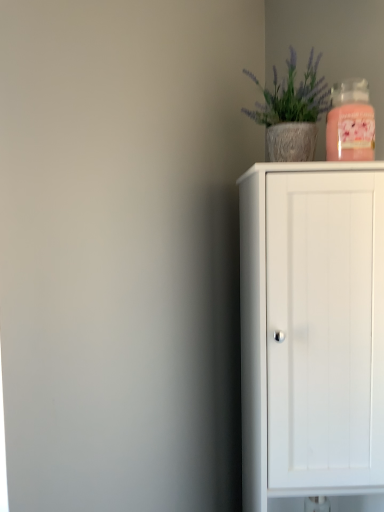
Question: Is textured concrete pot at upper right bigger than pink glass candle at upper right?

Choices:
 (A) no
 (B) yes

Answer: (B)

Question: Is pink glass candle at upper right completely or partially inside textured concrete pot at upper right?

Choices:
 (A) no
 (B) yes

Answer: (A)

Question: Is textured concrete pot at upper right shorter than pink glass candle at upper right?

Choices:
 (A) yes
 (B) no

Answer: (B)

Question: Is there a large distance between textured concrete pot at upper right and pink glass candle at upper right?

Choices:
 (A) yes
 (B) no

Answer: (B)

Question: Is textured concrete pot at upper right turned away from pink glass candle at upper right?

Choices:
 (A) no
 (B) yes

Answer: (A)

Question: Looking at their shapes, would you say pink glass candle at upper right is wider or thinner than textured concrete pot at upper right?

Choices:
 (A) thin
 (B) wide

Answer: (A)

Question: Would you say pink glass candle at upper right is inside or outside textured concrete pot at upper right?

Choices:
 (A) inside
 (B) outside

Answer: (B)

Question: From a real-world perspective, is pink glass candle at upper right physically located above or below textured concrete pot at upper right?

Choices:
 (A) below
 (B) above

Answer: (A)

Question: Based on their sizes in the image, would you say pink glass candle at upper right is bigger or smaller than textured concrete pot at upper right?

Choices:
 (A) big
 (B) small

Answer: (B)

Question: Is point (337, 159) positioned closer to the camera than point (299, 425)?

Choices:
 (A) farther
 (B) closer

Answer: (B)

Question: Is pink glass candle at upper right situated inside white matte cabinet at right or outside?

Choices:
 (A) inside
 (B) outside

Answer: (B)

Question: Looking at the image, does pink glass candle at upper right seem bigger or smaller compared to white matte cabinet at right?

Choices:
 (A) big
 (B) small

Answer: (B)

Question: From the image's perspective, is pink glass candle at upper right located above or below white matte cabinet at right?

Choices:
 (A) above
 (B) below

Answer: (A)

Question: Would you say textured concrete pot at upper right is to the left or to the right of white matte cabinet at right in the picture?

Choices:
 (A) left
 (B) right

Answer: (A)

Question: Would you say textured concrete pot at upper right is inside or outside white matte cabinet at right?

Choices:
 (A) inside
 (B) outside

Answer: (B)